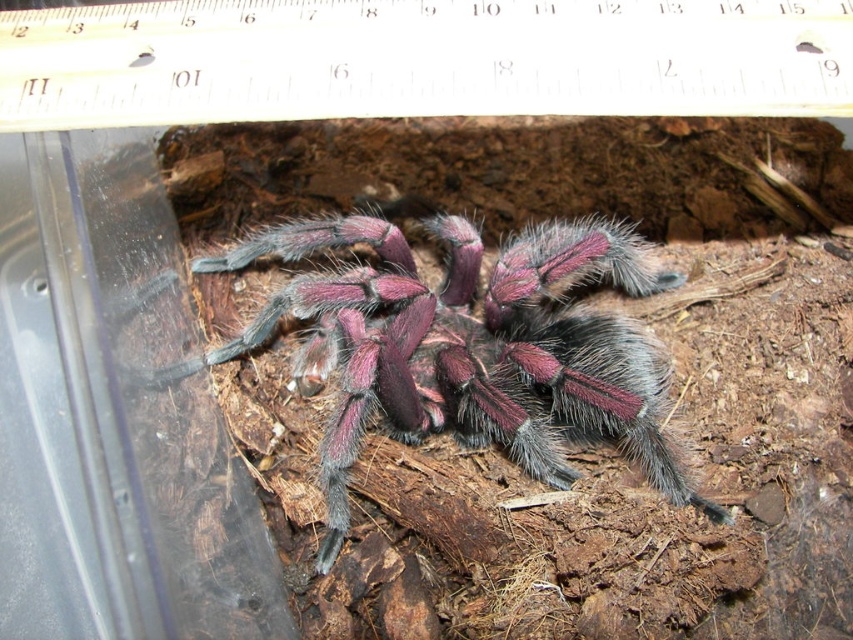
Does white plastic ruler at upper center appear under fuzzy purple spider at center?

No.

Is white plastic ruler at upper center further to camera compared to fuzzy purple spider at center?

No, white plastic ruler at upper center is closer to the viewer.

Who is more forward, (389, 19) or (492, 378)?

Point (389, 19) is in front.

Where is `white plastic ruler at upper center`? The width and height of the screenshot is (853, 640). white plastic ruler at upper center is located at coordinates [421, 60].